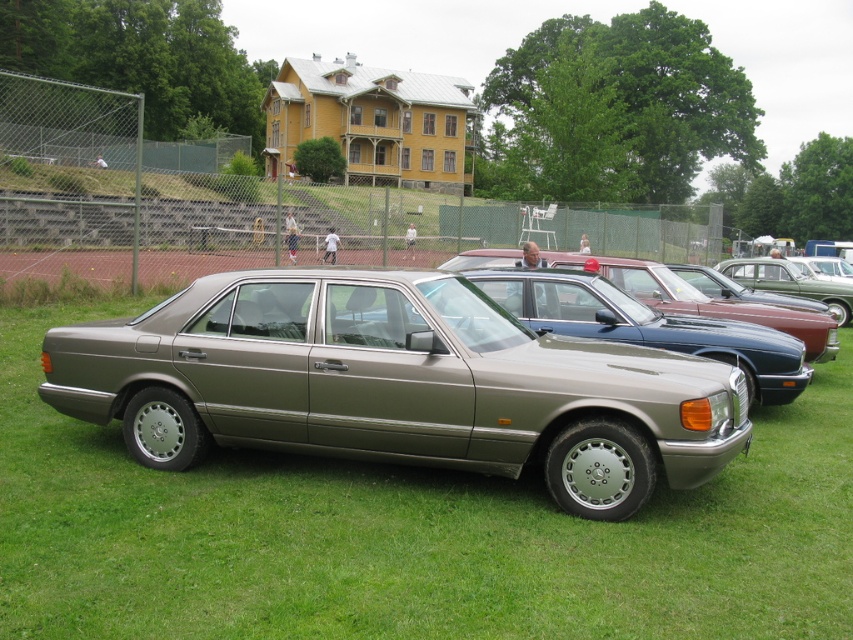
Which is below, satin metallic sedan at center or satin silver car at center?

satin metallic sedan at center is lower down.

Does satin metallic sedan at center have a lesser width compared to satin silver car at center?

In fact, satin metallic sedan at center might be wider than satin silver car at center.

Is point (434, 448) positioned after point (613, 269)?

No, it is in front of (613, 269).

Find the location of a particular element. satin metallic sedan at center is located at coordinates (397, 385).

Can you confirm if satin metallic sedan at center is taller than metallic red car at center?

Yes.

Between point (196, 339) and point (788, 266), which one is positioned in front?

Point (196, 339)

At what (x,y) coordinates should I click in order to perform the action: click on satin metallic sedan at center. Please return your answer as a coordinate pair (x, y). Image resolution: width=853 pixels, height=640 pixels. Looking at the image, I should click on (397, 385).

Which is in front, point (471, 257) or point (744, 260)?

Point (471, 257)

Locate an element on the screen. The width and height of the screenshot is (853, 640). satin silver car at center is located at coordinates (718, 305).